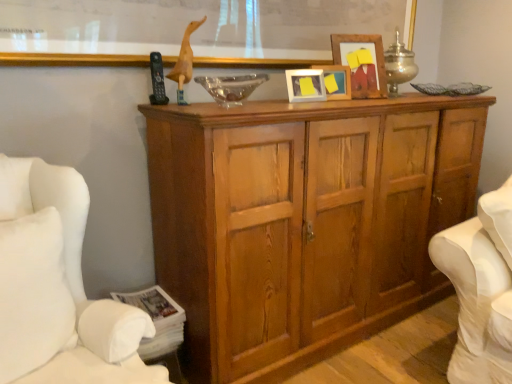
Describe the element at coordinates (481, 289) in the screenshot. I see `white fabric swivel chair at right` at that location.

You are a GUI agent. You are given a task and a screenshot of the screen. Output one action in this format:
    pyautogui.click(x=<x>, y=<y>)
    Task: Click on the metallic silver table lamp at upper center
    The height and width of the screenshot is (384, 512).
    Given the screenshot: What is the action you would take?
    pyautogui.click(x=399, y=65)

Find the location of a particular element. matte wooden picture frame at center, arranged as the third picture frame when viewed from the right is located at coordinates (305, 85).

At what (x,y) coordinates should I click in order to perform the action: click on wooden picture frame at upper center, placed as the 1th picture frame when sorted from right to left. Please return your answer as a coordinate pair (x, y). Image resolution: width=512 pixels, height=384 pixels. Looking at the image, I should click on (362, 63).

Identify the location of wooden cabinet at left. This screenshot has width=512, height=384. (60, 289).

From the image's perspective, relative to metallic silver table lamp at upper center, is wooden picture frame at upper center, placed as the 1th picture frame when sorted from right to left, above or below?

Based on their image positions, wooden picture frame at upper center, placed as the 1th picture frame when sorted from right to left, is located beneath metallic silver table lamp at upper center.

Considering the relative positions of wooden picture frame at upper center, which is the third picture frame in left-to-right order, and metallic silver table lamp at upper center in the image provided, is wooden picture frame at upper center, which is the third picture frame in left-to-right order, to the left of metallic silver table lamp at upper center from the viewer's perspective?

Yes, wooden picture frame at upper center, which is the third picture frame in left-to-right order, is to the left of metallic silver table lamp at upper center.

Considering the sizes of wooden picture frame at upper center, which is the third picture frame in left-to-right order, and metallic silver table lamp at upper center in the image, is wooden picture frame at upper center, which is the third picture frame in left-to-right order, taller or shorter than metallic silver table lamp at upper center?

In the image, wooden picture frame at upper center, which is the third picture frame in left-to-right order, appears to be shorter than metallic silver table lamp at upper center.

Does point (355, 48) lie behind point (409, 67)?

No, (355, 48) is closer to viewer.

Measure the distance from wooden cupboard at center to wooden picture frame at upper center, placed as the 1th picture frame when sorted from right to left.

wooden cupboard at center and wooden picture frame at upper center, placed as the 1th picture frame when sorted from right to left, are 26.89 inches apart.

Is wooden cupboard at center at the left side of wooden picture frame at upper center, which is the third picture frame in left-to-right order?

Indeed, wooden cupboard at center is positioned on the left side of wooden picture frame at upper center, which is the third picture frame in left-to-right order.

Consider the image. Is wooden cupboard at center wider than wooden picture frame at upper center, which is the third picture frame in left-to-right order?

Correct, the width of wooden cupboard at center exceeds that of wooden picture frame at upper center, which is the third picture frame in left-to-right order.

Are metallic silver table lamp at upper center and wooden picture frame at upper center, placed as the 1th picture frame when sorted from right to left, beside each other?

No, metallic silver table lamp at upper center is not in contact with wooden picture frame at upper center, placed as the 1th picture frame when sorted from right to left.

Is point (393, 96) closer to viewer compared to point (371, 90)?

Yes, point (393, 96) is closer to viewer.

At what (x,y) coordinates should I click in order to perform the action: click on table lamp above the wooden picture frame at upper center, placed as the 1th picture frame when sorted from right to left (from a real-world perspective). Please return your answer as a coordinate pair (x, y). This screenshot has height=384, width=512. Looking at the image, I should click on (399, 65).

From a real-world perspective, which object rests below the other?

From a 3D spatial view, wooden picture frame at upper center, which is the third picture frame in left-to-right order, is below.

Is wooden frame at upper center positioned with its back to wooden picture frame at center, which is the second picture frame from left to right?

No, wooden frame at upper center is not facing the opposite direction of wooden picture frame at center, which is the second picture frame from left to right.

Which is more to the left, wooden frame at upper center or wooden picture frame at center, which is the second picture frame from left to right?

From the viewer's perspective, wooden frame at upper center appears more on the left side.

At what (x,y) coordinates should I click in order to perform the action: click on bulletin board in front of the wooden picture frame at center, which is the second picture frame from left to right. Please return your answer as a coordinate pair (x, y). The image size is (512, 384). Looking at the image, I should click on (194, 33).

Does wooden frame at upper center have a lesser width compared to wooden picture frame at center, which is the second picture frame from left to right?

Incorrect, the width of wooden frame at upper center is not less than that of wooden picture frame at center, which is the second picture frame from left to right.

Which is more to the right, white fabric swivel chair at right or matte wooden picture frame at center, marked as the first picture frame in a left-to-right arrangement?

Positioned to the right is white fabric swivel chair at right.

Is white fabric swivel chair at right bigger than matte wooden picture frame at center, marked as the first picture frame in a left-to-right arrangement?

Indeed, white fabric swivel chair at right has a larger size compared to matte wooden picture frame at center, marked as the first picture frame in a left-to-right arrangement.

Which object is wider, white fabric swivel chair at right or matte wooden picture frame at center, arranged as the third picture frame when viewed from the right?

white fabric swivel chair at right.

Between white fabric swivel chair at right and matte wooden picture frame at center, arranged as the third picture frame when viewed from the right, which one has less height?

Standing shorter between the two is matte wooden picture frame at center, arranged as the third picture frame when viewed from the right.

Is wooden frame at upper center at the back of matte wooden picture frame at center, marked as the first picture frame in a left-to-right arrangement?

No, wooden frame at upper center is not at the back of matte wooden picture frame at center, marked as the first picture frame in a left-to-right arrangement.

Looking at this image, are matte wooden picture frame at center, arranged as the third picture frame when viewed from the right, and wooden frame at upper center beside each other?

They are not placed beside each other.

Considering the positions of points (321, 84) and (2, 43), is point (321, 84) farther from camera compared to point (2, 43)?

Yes, point (321, 84) is farther from viewer.

Which point is more forward, (308, 83) or (201, 78)?

The point (308, 83) is closer.

Could you measure the distance between matte wooden picture frame at center, marked as the first picture frame in a left-to-right arrangement, and transparent glass bowl at center?

matte wooden picture frame at center, marked as the first picture frame in a left-to-right arrangement, and transparent glass bowl at center are 10.35 inches apart from each other.

Does matte wooden picture frame at center, marked as the first picture frame in a left-to-right arrangement, lie behind transparent glass bowl at center?

Yes, the depth of matte wooden picture frame at center, marked as the first picture frame in a left-to-right arrangement, is greater than that of transparent glass bowl at center.

Does matte wooden picture frame at center, arranged as the third picture frame when viewed from the right, contain transparent glass bowl at center?

Actually, transparent glass bowl at center is outside matte wooden picture frame at center, arranged as the third picture frame when viewed from the right.

Identify the location of picture frame that is the 1st object located in front of the metallic silver table lamp at upper center. The height and width of the screenshot is (384, 512). (362, 63).

You are a GUI agent. You are given a task and a screenshot of the screen. Output one action in this format:
    pyautogui.click(x=<x>, y=<y>)
    Task: Click on the cupboard below the wooden picture frame at upper center, which is the third picture frame in left-to-right order (from a real-world perspective)
    Image resolution: width=512 pixels, height=384 pixels.
    Given the screenshot: What is the action you would take?
    pyautogui.click(x=304, y=221)

When comparing their distances from metallic silver table lamp at upper center, does white fabric swivel chair at right or wooden cupboard at center seem closer?

wooden cupboard at center.

Looking at the image, which one is located closer to wooden picture frame at upper center, placed as the 1th picture frame when sorted from right to left, wooden cabinet at left or metallic silver table lamp at upper center?

Among the two, metallic silver table lamp at upper center is located nearer to wooden picture frame at upper center, placed as the 1th picture frame when sorted from right to left.

From the image, which object appears to be nearer to transparent glass bowl at center, matte wooden picture frame at center, arranged as the third picture frame when viewed from the right, or wooden cupboard at center?

Based on the image, matte wooden picture frame at center, arranged as the third picture frame when viewed from the right, appears to be nearer to transparent glass bowl at center.

Looking at the image, which one is located further to wooden picture frame at upper center, which is the third picture frame in left-to-right order, wooden cupboard at center or white fabric swivel chair at right?

white fabric swivel chair at right lies further to wooden picture frame at upper center, which is the third picture frame in left-to-right order, than the other object.

From the image, which object appears to be farther from wooden picture frame at center, the second picture frame viewed from the right, matte wooden picture frame at center, arranged as the third picture frame when viewed from the right, or metallic silver table lamp at upper center?

metallic silver table lamp at upper center.

From the picture: Which object lies nearer to the anchor point transparent glass bowl at center, wooden cabinet at left or wooden picture frame at upper center, which is the third picture frame in left-to-right order?

wooden picture frame at upper center, which is the third picture frame in left-to-right order, is positioned closer to the anchor transparent glass bowl at center.

When comparing their distances from transparent glass bowl at center, does white fabric swivel chair at right or wooden cabinet at left seem closer?

Based on the image, wooden cabinet at left appears to be nearer to transparent glass bowl at center.

Looking at the image, which one is located further to white fabric swivel chair at right, wooden frame at upper center or transparent glass bowl at center?

wooden frame at upper center.

Identify the location of table lamp located between wooden cabinet at left and white fabric swivel chair at right in the left-right direction. (399, 65).

Locate an element on the screen. This screenshot has width=512, height=384. table lamp between wooden frame at upper center and white fabric swivel chair at right vertically is located at coordinates (399, 65).

I want to click on glass bowl between wooden cabinet at left and white fabric swivel chair at right from left to right, so click(x=231, y=87).

Image resolution: width=512 pixels, height=384 pixels. I want to click on picture frame between wooden cabinet at left and wooden picture frame at center, which is the second picture frame from left to right, in the front-back direction, so click(305, 85).